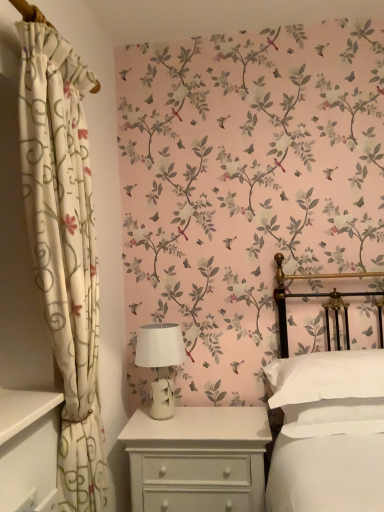
Image resolution: width=384 pixels, height=512 pixels. Find the location of `vacant region below white ceramic table lamp at center (from a real-world perspective)`. vacant region below white ceramic table lamp at center (from a real-world perspective) is located at coordinates (175, 416).